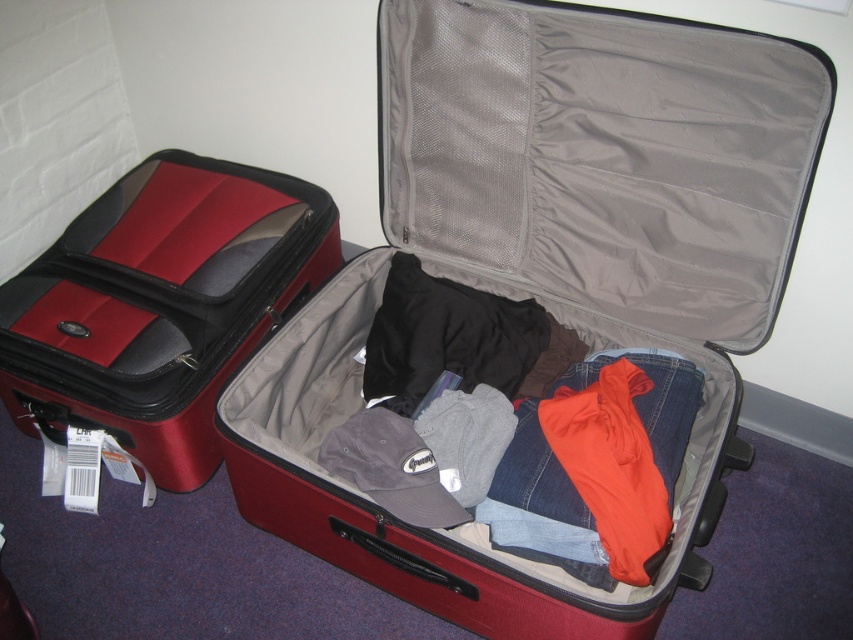
Question: Which point is closer to the camera?

Choices:
 (A) coord(21,332)
 (B) coord(618,454)

Answer: (B)

Question: Which object is positioned closest to the denim jeans at center?

Choices:
 (A) matte red suitcase at center
 (B) matte black suitcase at left

Answer: (A)

Question: Is matte red suitcase at center bigger than matte black suitcase at left?

Choices:
 (A) no
 (B) yes

Answer: (B)

Question: Which point is closer to the camera taking this photo?

Choices:
 (A) (346, 564)
 (B) (585, 474)

Answer: (B)

Question: Can you confirm if matte black suitcase at left is wider than denim jeans at center?

Choices:
 (A) yes
 (B) no

Answer: (A)

Question: Can you confirm if matte black suitcase at left is wider than denim jeans at center?

Choices:
 (A) no
 (B) yes

Answer: (B)